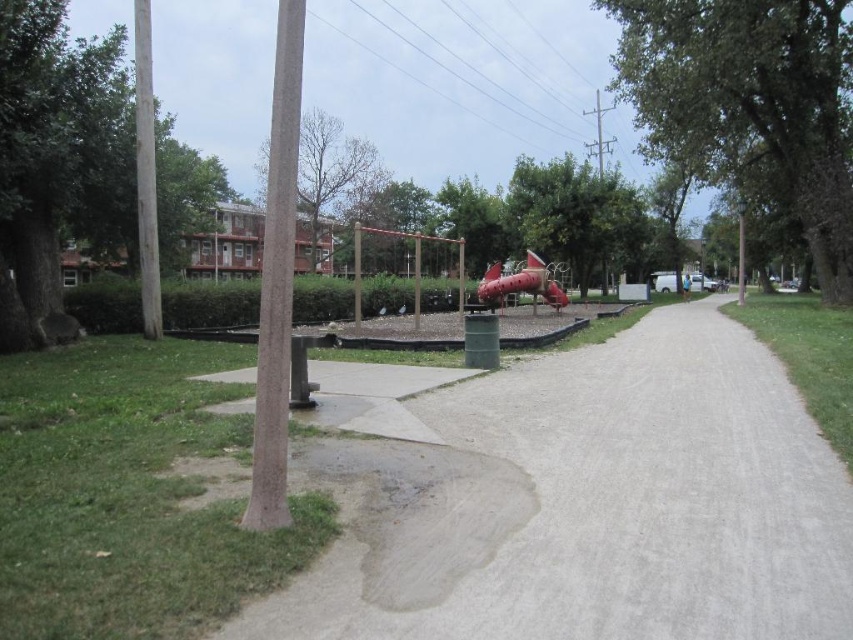
You are a park visitor who wants to install a new flag on the tallest object in the park. You see the brown textured pole at left and the bare wood tree at upper center. Which object should you choose to place the flag?

The bare wood tree at upper center is taller than the brown textured pole at left, so you should choose the bare wood tree at upper center to place the flag.

You are standing at the entrance of the park and want to locate the brown textured pole at left. According to the park layout, where would you find it?

The brown textured pole at left is located at point (277,280) in the park layout.